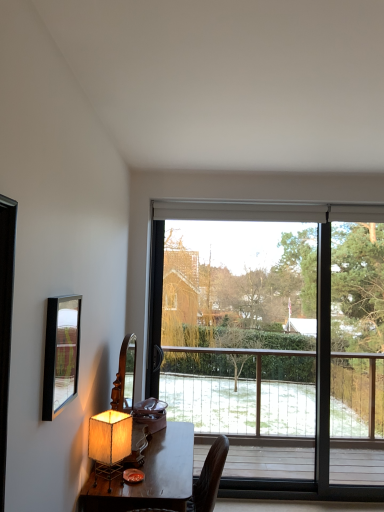
You are a GUI agent. You are given a task and a screenshot of the screen. Output one action in this format:
    pyautogui.click(x=<x>, y=<y>)
    Task: Click on the matte black mirror at left
    
    Given the screenshot: What is the action you would take?
    pyautogui.click(x=61, y=354)

Measure the distance between point (119,488) and camera.

The depth of point (119,488) is 2.09 meters.

Find the location of a particular element. This screenshot has width=384, height=512. matte black mirror at left is located at coordinates coord(61,354).

Considering the relative sizes of transparent glass window at center and matte black mirror at left in the image provided, is transparent glass window at center wider than matte black mirror at left?

Yes.

Considering the relative sizes of transparent glass window at center and matte black mirror at left in the image provided, is transparent glass window at center taller than matte black mirror at left?

Correct, transparent glass window at center is much taller as matte black mirror at left.

Is transparent glass window at center facing towards matte black mirror at left?

Yes, transparent glass window at center faces towards matte black mirror at left.

Considering the positions of objects transparent glass window at center and matte black mirror at left in the image provided, who is more to the right, transparent glass window at center or matte black mirror at left?

transparent glass window at center is more to the right.

Which object is closer to the camera taking this photo, wooden desk at lower left or matte beige lampshade at lower left?

wooden desk at lower left is in front.

Visually, is wooden desk at lower left positioned to the left or to the right of matte beige lampshade at lower left?

Clearly, wooden desk at lower left is on the right of matte beige lampshade at lower left in the image.

Image resolution: width=384 pixels, height=512 pixels. Identify the location of table lamp located behind the wooden desk at lower left. (109, 443).

From the image's perspective, between wooden desk at lower left and transparent glass window at center, who is located below?

wooden desk at lower left appears lower in the image.

Considering the relative sizes of wooden desk at lower left and transparent glass window at center in the image provided, is wooden desk at lower left smaller than transparent glass window at center?

Actually, wooden desk at lower left might be larger than transparent glass window at center.

Looking at this image, who is shorter, wooden desk at lower left or transparent glass window at center?

Standing shorter between the two is wooden desk at lower left.

Can we say wooden desk at lower left lies outside transparent glass window at center?

Yes, wooden desk at lower left is outside of transparent glass window at center.

From the image's perspective, is matte beige lampshade at lower left positioned above or below transparent glass window at center?

Based on their image positions, matte beige lampshade at lower left is located beneath transparent glass window at center.

In terms of width, does matte beige lampshade at lower left look wider or thinner when compared to transparent glass window at center?

Considering their sizes, matte beige lampshade at lower left looks broader than transparent glass window at center.

Is matte beige lampshade at lower left to the left or to the right of transparent glass window at center in the image?

Clearly, matte beige lampshade at lower left is on the left of transparent glass window at center in the image.

Does point (92, 430) lie in front of point (207, 251)?

Yes, it is.

Which of these two, matte black mirror at left or transparent glass window at center, is thinner?

Thinner between the two is matte black mirror at left.

From the image's perspective, would you say matte black mirror at left is shown under transparent glass window at center?

No.

Considering the relative sizes of matte black mirror at left and transparent glass window at center in the image provided, is matte black mirror at left smaller than transparent glass window at center?

Yes.

Between matte beige lampshade at lower left and wooden desk at lower left, which one has smaller width?

matte beige lampshade at lower left.

In terms of size, does matte beige lampshade at lower left appear bigger or smaller than wooden desk at lower left?

matte beige lampshade at lower left is smaller than wooden desk at lower left.

Identify the location of desk in front of the matte beige lampshade at lower left. (150, 476).

Who is shorter, matte beige lampshade at lower left or wooden desk at lower left?

Standing shorter between the two is matte beige lampshade at lower left.

Is transparent glass window at center to the left of wooden desk at lower left from the viewer's perspective?

No, transparent glass window at center is not to the left of wooden desk at lower left.

You are a GUI agent. You are given a task and a screenshot of the screen. Output one action in this format:
    pyautogui.click(x=<x>, y=<y>)
    Task: Click on the desk that is on the left side of transparent glass window at center
    This screenshot has width=384, height=512.
    Given the screenshot: What is the action you would take?
    pyautogui.click(x=150, y=476)

Is transparent glass window at center turned away from wooden desk at lower left?

No, transparent glass window at center is not facing the opposite direction of wooden desk at lower left.

From the image's perspective, is transparent glass window at center under wooden desk at lower left?

No, from the image's perspective, transparent glass window at center is not below wooden desk at lower left.

What are the coordinates of `window to the right of matte black mirror at left` in the screenshot? It's located at (274, 342).

Locate an element on the screen. table lamp that is behind the wooden desk at lower left is located at coordinates click(x=109, y=443).

Which object lies nearer to the anchor point matte beige lampshade at lower left, wooden desk at lower left or matte black mirror at left?

Among the two, wooden desk at lower left is located nearer to matte beige lampshade at lower left.

Based on their spatial positions, is matte beige lampshade at lower left or transparent glass window at center closer to matte black mirror at left?

matte beige lampshade at lower left lies closer to matte black mirror at left than the other object.

Estimate the real-world distances between objects in this image. Which object is closer to wooden desk at lower left, transparent glass window at center or matte black mirror at left?

matte black mirror at left is closer to wooden desk at lower left.

From the picture: Considering their positions, is wooden desk at lower left positioned further to transparent glass window at center than matte black mirror at left?

matte black mirror at left is further to transparent glass window at center.

Estimate the real-world distances between objects in this image. Which object is further from matte beige lampshade at lower left, transparent glass window at center or matte black mirror at left?

transparent glass window at center.

From the image, which object appears to be farther from matte black mirror at left, transparent glass window at center or matte beige lampshade at lower left?

The object further to matte black mirror at left is transparent glass window at center.

When comparing their distances from wooden desk at lower left, does matte beige lampshade at lower left or transparent glass window at center seem further?

→ transparent glass window at center is further to wooden desk at lower left.

Estimate the real-world distances between objects in this image. Which object is further from matte beige lampshade at lower left, wooden desk at lower left or transparent glass window at center?

transparent glass window at center is positioned further to the anchor matte beige lampshade at lower left.

At what (x,y) coordinates should I click in order to perform the action: click on table lamp between matte black mirror at left and wooden desk at lower left from top to bottom. Please return your answer as a coordinate pair (x, y). This screenshot has width=384, height=512. Looking at the image, I should click on (109, 443).

Find the location of a particular element. table lamp between wooden desk at lower left and transparent glass window at center in the front-back direction is located at coordinates (109, 443).

Where is `table lamp positioned between matte black mirror at left and transparent glass window at center from near to far`? This screenshot has width=384, height=512. table lamp positioned between matte black mirror at left and transparent glass window at center from near to far is located at coordinates (109, 443).

You are a GUI agent. You are given a task and a screenshot of the screen. Output one action in this format:
    pyautogui.click(x=<x>, y=<y>)
    Task: Click on the desk between matte black mirror at left and transparent glass window at center from front to back
    
    Given the screenshot: What is the action you would take?
    pyautogui.click(x=150, y=476)